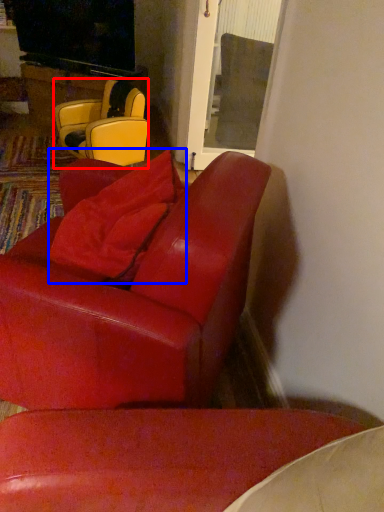
Question: Which point is further to the camera, chair (highlighted by a red box) or pillow (highlighted by a blue box)?

Choices:
 (A) chair
 (B) pillow

Answer: (A)